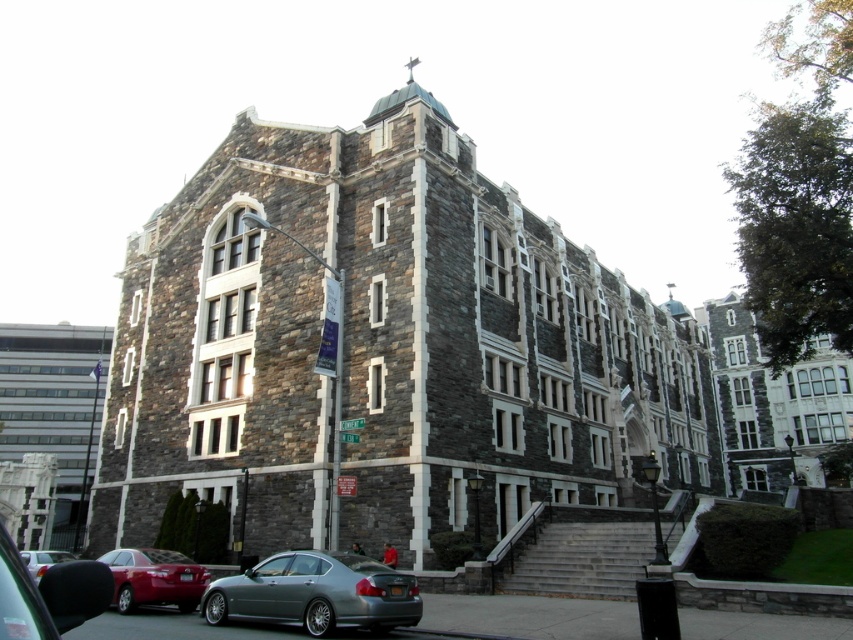
Question: Among these points, which one is nearest to the camera?

Choices:
 (A) (39, 564)
 (B) (10, 557)

Answer: (B)

Question: From the image, what is the correct spatial relationship of silver metallic sedan at lower left in relation to metallic silver sedan at lower left?

Choices:
 (A) below
 (B) above

Answer: (A)

Question: Does metallic silver sedan at lower left appear under shiny red sedan at lower left?

Choices:
 (A) no
 (B) yes

Answer: (A)

Question: In this image, where is gray stone church at center located relative to shiny red sedan at lower left?

Choices:
 (A) left
 (B) right

Answer: (B)

Question: Which object is positioned closest to the gray stone church at center?

Choices:
 (A) stone building at center
 (B) silver metallic sedan at lower left
 (C) gray stone church at left

Answer: (B)

Question: Which point is farther to the camera?

Choices:
 (A) [811, 477]
 (B) [479, 412]
 (C) [10, 547]

Answer: (A)